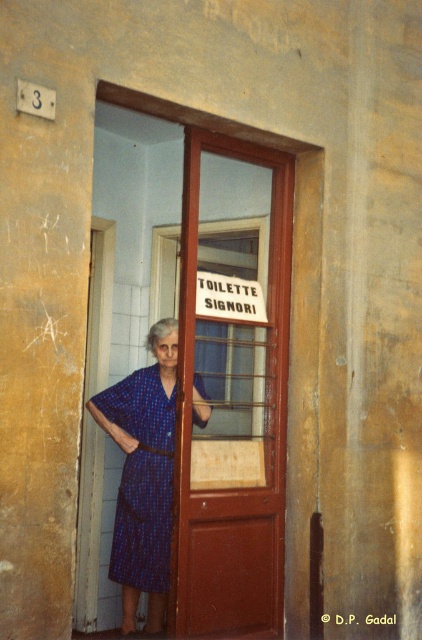
Question: Can you confirm if brown wooden door at center is smaller than blue printed dress at center?

Choices:
 (A) no
 (B) yes

Answer: (A)

Question: Is brown wooden door at center in front of blue printed dress at center?

Choices:
 (A) no
 (B) yes

Answer: (B)

Question: Which of the following is the closest to the observer?

Choices:
 (A) brown wooden door at center
 (B) blue printed dress at center

Answer: (A)

Question: Is brown wooden door at center positioned before blue printed dress at center?

Choices:
 (A) no
 (B) yes

Answer: (B)

Question: Which of the following is the farthest from the observer?

Choices:
 (A) (121, 392)
 (B) (232, 433)

Answer: (A)